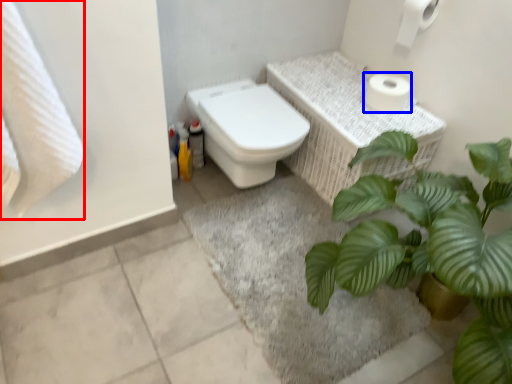
Question: Which of the following is the farthest to the observer, bath towel (highlighted by a red box) or toilet paper (highlighted by a blue box)?

Choices:
 (A) bath towel
 (B) toilet paper

Answer: (B)